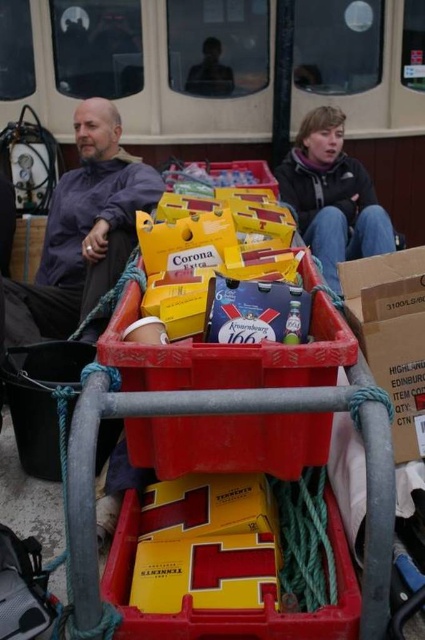
You are organizing a picnic and need to know which item takes up more space between the cardboard at center and the dark gray fleece jacket at upper right. Which one should you consider packing first to optimize space?

The dark gray fleece jacket at upper right takes up more space than the cardboard at center, so you should pack the dark gray fleece jacket at upper right first to optimize space.

You are organizing a picnic and need to place a matte purple shirt at left and a cardboard at center into a small bag. Which item should you place first to ensure they both fit?

Since the matte purple shirt at left is to the left of cardboard at center, you should place the cardboard at center first as it is closer to the opening of the bag, making it easier to access both items later.